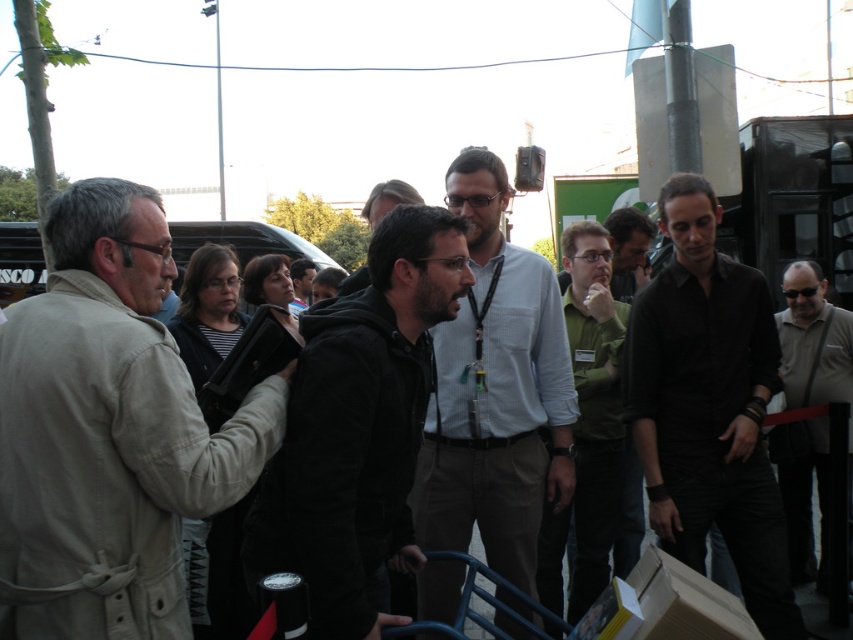
Is black matte jacket at center wider than matte black shirt at center?

Correct, the width of black matte jacket at center exceeds that of matte black shirt at center.

Based on the photo, does black matte jacket at center have a smaller size compared to matte black shirt at center?

Incorrect, black matte jacket at center is not smaller in size than matte black shirt at center.

Identify the location of black matte jacket at center. Image resolution: width=853 pixels, height=640 pixels. (358, 428).

Where is `black matte jacket at center`? black matte jacket at center is located at coordinates (358, 428).

The width and height of the screenshot is (853, 640). Describe the element at coordinates (495, 392) in the screenshot. I see `light blue shirt at center` at that location.

Which is in front, point (460, 540) or point (795, 604)?

Point (795, 604)

In order to click on light blue shirt at center in this screenshot , I will do `click(495, 392)`.

Does black matte jacket at center appear on the left side of gray fabric shirt at center?

Yes, black matte jacket at center is to the left of gray fabric shirt at center.

Who is more forward, (x=352, y=412) or (x=770, y=433)?

Point (x=352, y=412) is more forward.

Looking at this image, who is more forward, (405, 435) or (819, 344)?

Point (405, 435)

This screenshot has width=853, height=640. What are the coordinates of `black matte jacket at center` in the screenshot? It's located at (358, 428).